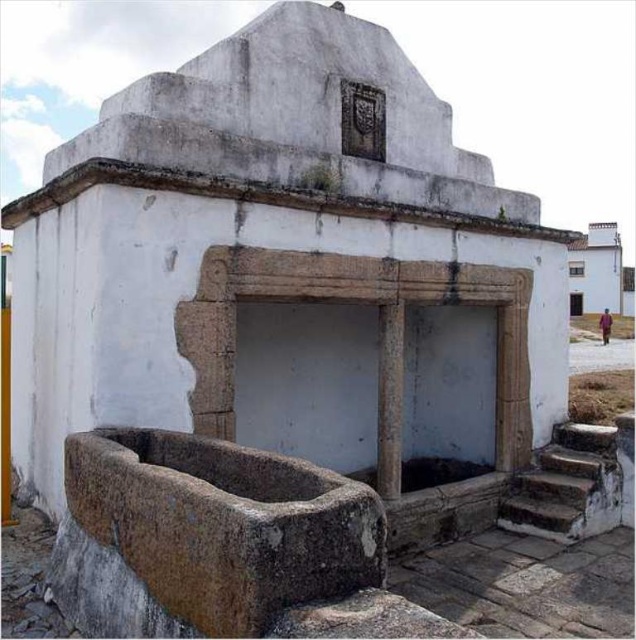
Question: Does rusty stone stairs at lower right appear over gray stone pillar at center?

Choices:
 (A) yes
 (B) no

Answer: (B)

Question: Can you confirm if rusty stone stairs at lower right is bigger than gray stone pillar at center?

Choices:
 (A) no
 (B) yes

Answer: (B)

Question: Which of the following is the closest to the observer?

Choices:
 (A) rusty stone stairs at lower right
 (B) gray stone pillar at center

Answer: (B)

Question: Which point is farther from the camera taking this photo?

Choices:
 (A) (583, 426)
 (B) (392, 384)

Answer: (A)

Question: Is rusty stone stairs at lower right above gray stone pillar at center?

Choices:
 (A) no
 (B) yes

Answer: (A)